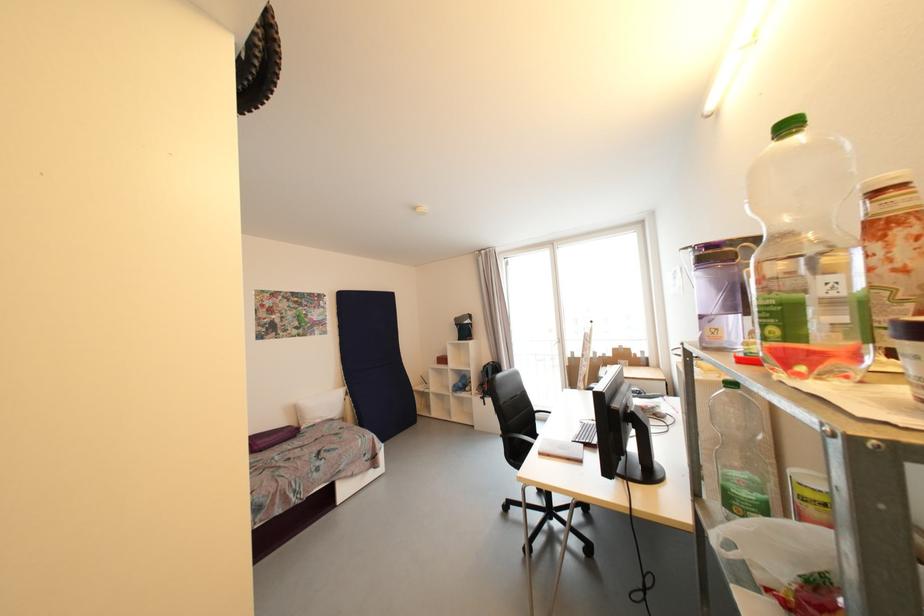
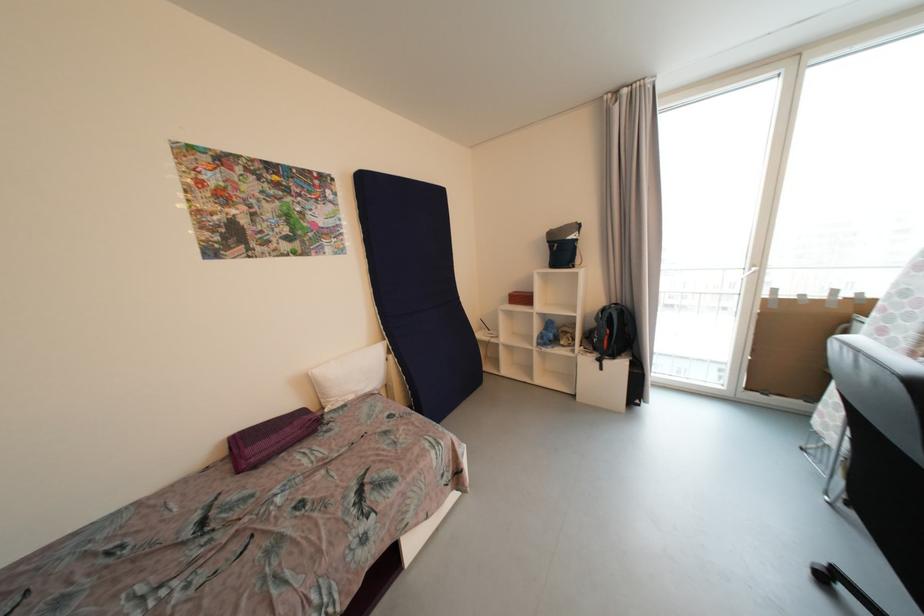
The point at (300, 411) is marked in the first image. Where is the corresponding point in the second image?

(315, 386)